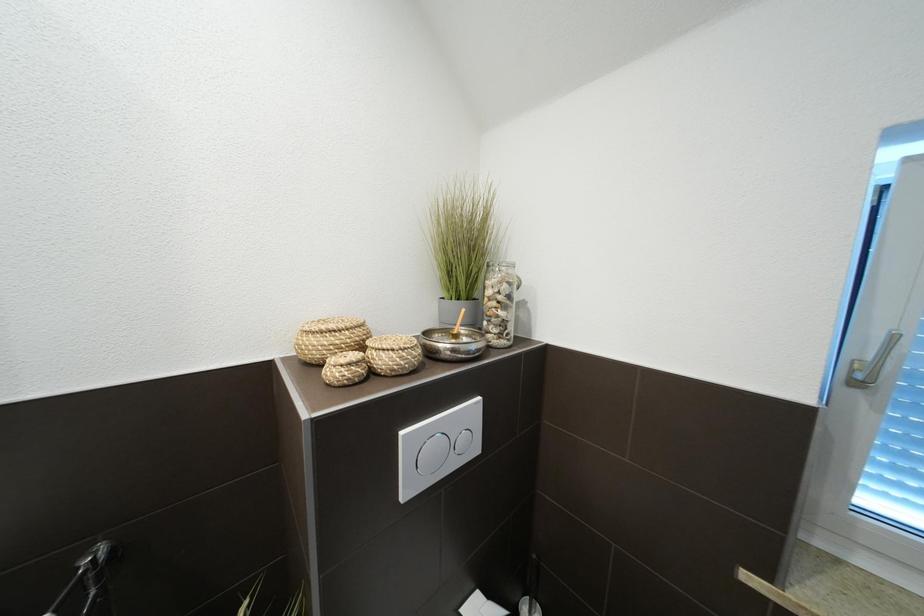
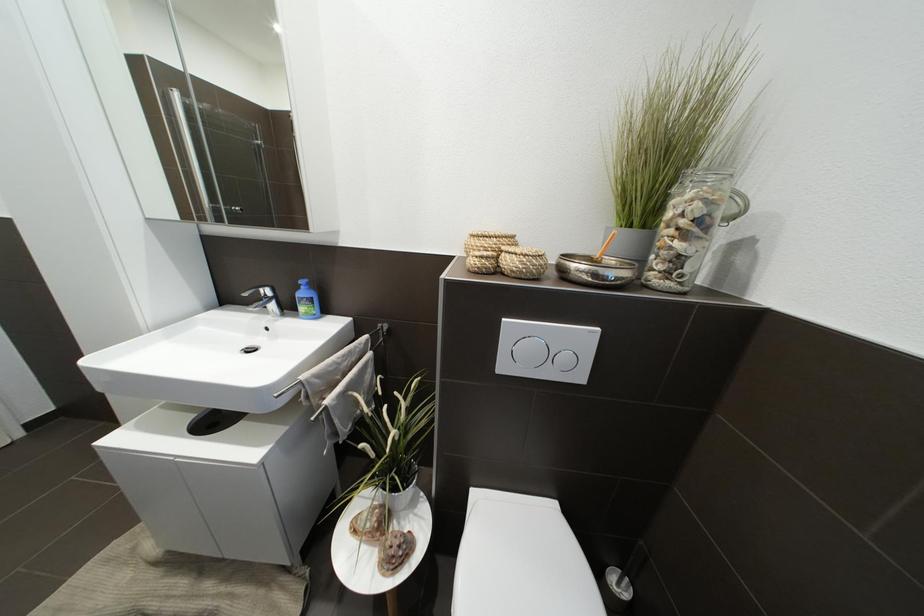
Question: The first image is from the beginning of the video and the second image is from the end. How did the camera likely rotate when shooting the video?

Choices:
 (A) Left
 (B) Right
 (C) Up
 (D) Down

Answer: (A)